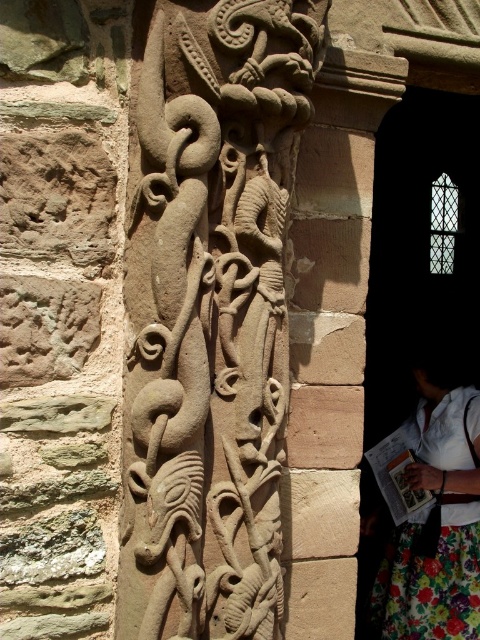
Between stone textured dragon at center and carved stone pillar at center, which one is positioned higher?

stone textured dragon at center

Does stone textured dragon at center have a greater height compared to carved stone pillar at center?

Incorrect, stone textured dragon at center's height is not larger of carved stone pillar at center's.

Find the location of `stone textured dragon at center`. stone textured dragon at center is located at coordinates (211, 316).

Can you confirm if stone textured dragon at center is thinner than floral skirt at lower right?

Correct, stone textured dragon at center's width is less than floral skirt at lower right's.

Between stone textured dragon at center and floral skirt at lower right, which one appears on the left side from the viewer's perspective?

stone textured dragon at center

Which is in front, point (321, 45) or point (448, 413)?

Point (321, 45) is in front.

Identify the location of stone textured dragon at center. (211, 316).

Based on the photo, does carved stone pillar at center have a greater height compared to floral skirt at lower right?

Yes, carved stone pillar at center is taller than floral skirt at lower right.

Can you confirm if carved stone pillar at center is smaller than floral skirt at lower right?

Yes.

Which is in front, point (344, 589) or point (417, 422)?

Point (344, 589) is more forward.

You are a GUI agent. You are given a task and a screenshot of the screen. Output one action in this format:
    pyautogui.click(x=<x>, y=<y>)
    Task: Click on the carved stone pillar at center
    The width and height of the screenshot is (480, 640).
    Given the screenshot: What is the action you would take?
    pyautogui.click(x=330, y=339)